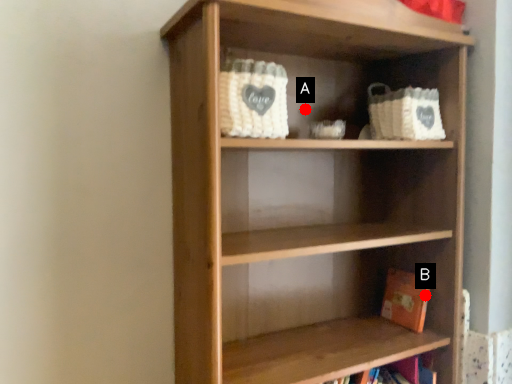
Question: Two points are circled on the image, labeled by A and B beside each circle. Which point is farther from the camera taking this photo?

Choices:
 (A) A is further
 (B) B is further

Answer: (A)